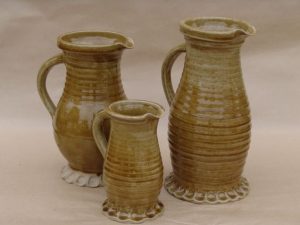
Find the location of a particular element. small pitcher spout is located at coordinates (157, 110).